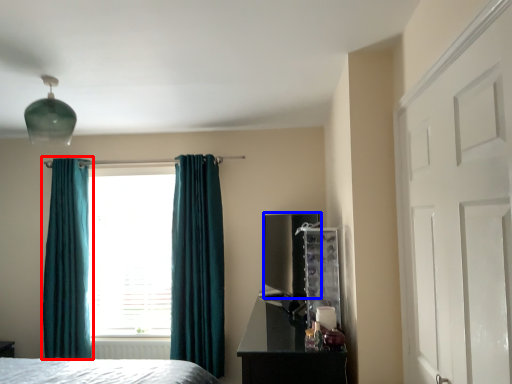
Question: Which object appears farthest to the camera in this image, curtain (highlighted by a red box) or appliance (highlighted by a blue box)?

Choices:
 (A) curtain
 (B) appliance

Answer: (A)